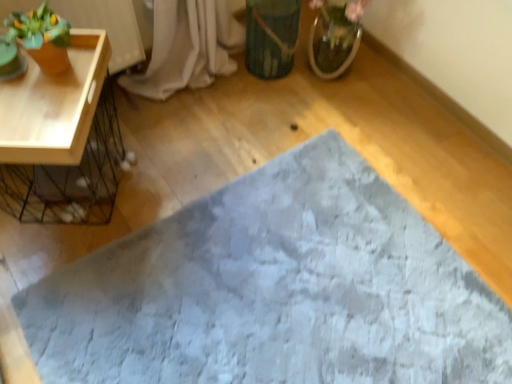
Question: Would you consider matte orange pot at upper left to be distant from gray textured bath mat at center?

Choices:
 (A) no
 (B) yes

Answer: (A)

Question: Considering the relative sizes of matte orange pot at upper left and gray textured bath mat at center in the image provided, is matte orange pot at upper left shorter than gray textured bath mat at center?

Choices:
 (A) no
 (B) yes

Answer: (A)

Question: Is matte orange pot at upper left thinner than gray textured bath mat at center?

Choices:
 (A) yes
 (B) no

Answer: (A)

Question: Is the depth of matte orange pot at upper left greater than that of gray textured bath mat at center?

Choices:
 (A) no
 (B) yes

Answer: (B)

Question: From the image's perspective, is matte orange pot at upper left above gray textured bath mat at center?

Choices:
 (A) yes
 (B) no

Answer: (A)

Question: Is matte orange pot at upper left at the left side of gray textured bath mat at center?

Choices:
 (A) no
 (B) yes

Answer: (B)

Question: Is gray textured bath mat at center at the back of green matte vase at center?

Choices:
 (A) yes
 (B) no

Answer: (B)

Question: Does green matte vase at center have a greater height compared to gray textured bath mat at center?

Choices:
 (A) yes
 (B) no

Answer: (A)

Question: Could you tell me if green matte vase at center is turned towards gray textured bath mat at center?

Choices:
 (A) yes
 (B) no

Answer: (B)

Question: Does green matte vase at center have a greater width compared to gray textured bath mat at center?

Choices:
 (A) yes
 (B) no

Answer: (B)

Question: From the image's perspective, would you say green matte vase at center is shown under gray textured bath mat at center?

Choices:
 (A) no
 (B) yes

Answer: (A)

Question: Are green matte vase at center and gray textured bath mat at center beside each other?

Choices:
 (A) yes
 (B) no

Answer: (B)

Question: Can you confirm if gray textured bath mat at center is taller than matte orange pot at upper left?

Choices:
 (A) yes
 (B) no

Answer: (B)